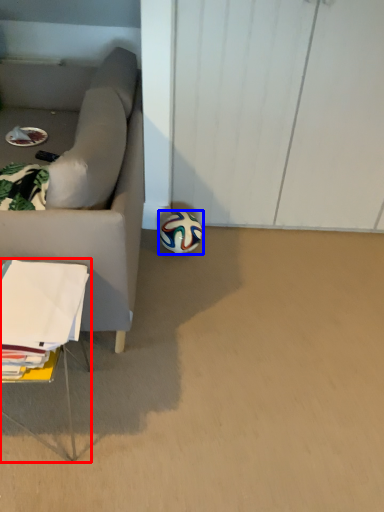
Question: Which object is closer to the camera taking this photo, table (highlighted by a red box) or football (highlighted by a blue box)?

Choices:
 (A) table
 (B) football

Answer: (A)